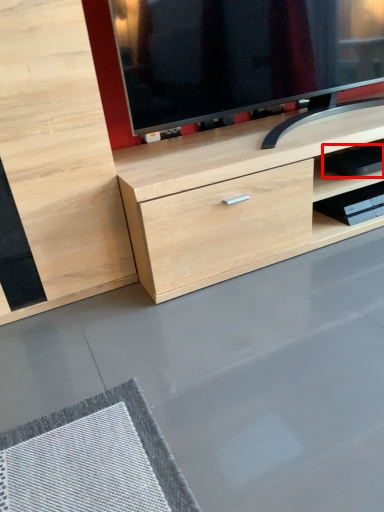
Question: From the image's perspective, considering the relative positions of equipment (annotated by the red box) and shelf in the image provided, where is equipment (annotated by the red box) located with respect to the staircase?

Choices:
 (A) above
 (B) below

Answer: (A)